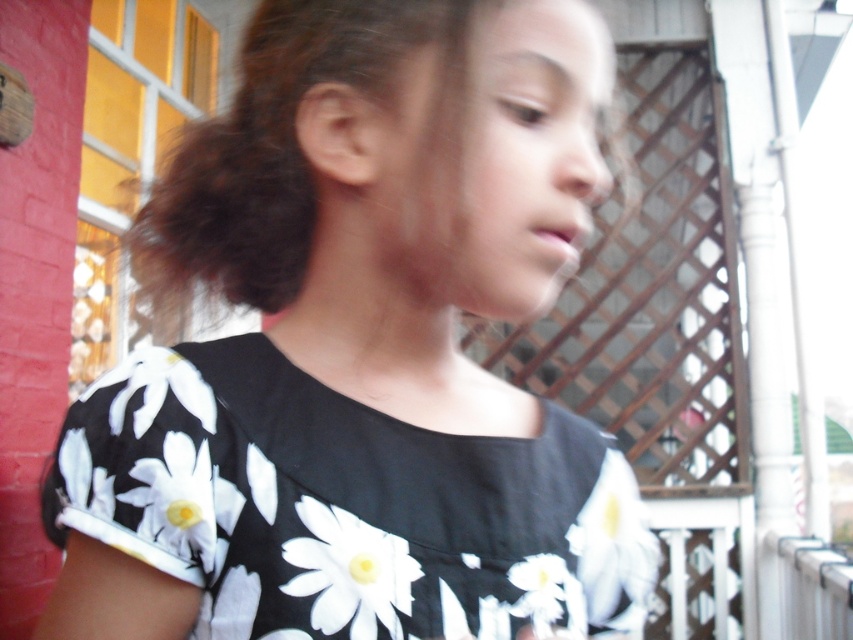
You are a photographer adjusting the focus on your camera. You want to ensure both the white matte daisy at lower left and the white matte daisy at lower right are in focus. Which daisy should you focus on first to achieve this?

You should focus on the white matte daisy at lower right first because it is larger and likely closer to the camera, making it easier to adjust the focus to include both in the frame.

The young girl is standing in front of a red brick wall with a yellow window. She is wearing a black floral fabric dress at center and has dark brown curly hair at center. Which of these two items takes up more visual space in the image?

The dark brown curly hair at center takes up more visual space than the black floral fabric dress at center in the image.

You are a photographer trying to focus on the girl in the image. You notice a point at coordinates (337, 502). Based on the scene, where would this point likely be located on the girl?

The point at coordinates (337, 502) is located on the black floral fabric dress at center.